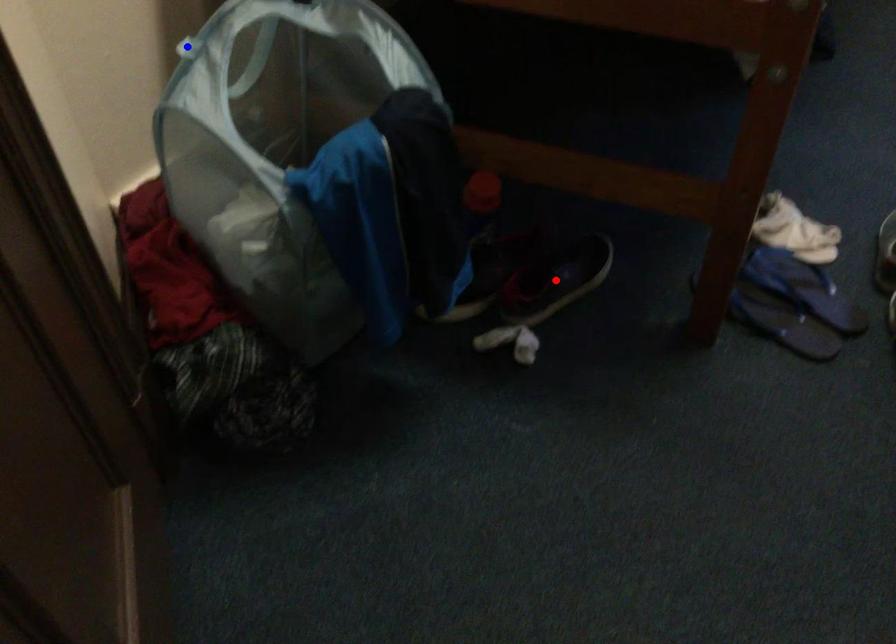
Question: In the image, two points are highlighted. Which point is nearer to the camera? Reply with the corresponding letter.

Choices:
 (A) blue point
 (B) red point

Answer: (A)